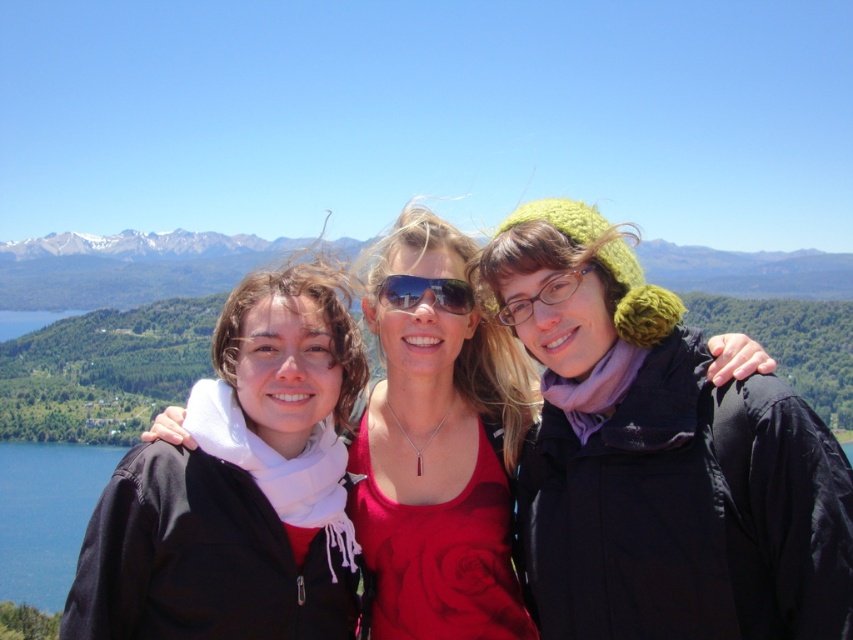
Question: Does matte black jacket at center have a larger size compared to shiny blue sunglasses at center?

Choices:
 (A) yes
 (B) no

Answer: (A)

Question: Is matte black jacket at center below shiny blue sunglasses at center?

Choices:
 (A) no
 (B) yes

Answer: (B)

Question: Which point is closer to the camera taking this photo?

Choices:
 (A) (445, 307)
 (B) (613, 624)

Answer: (B)

Question: Based on their relative distances, which object is nearer to the matte black jacket at center?

Choices:
 (A) shiny blue sunglasses at center
 (B) knitted green hat at center

Answer: (B)

Question: Does knitted green hat at center have a greater width compared to matte black jacket at center?

Choices:
 (A) no
 (B) yes

Answer: (A)

Question: Which object is closer to the camera taking this photo?

Choices:
 (A) knitted green hat at center
 (B) matte black jacket at center

Answer: (A)